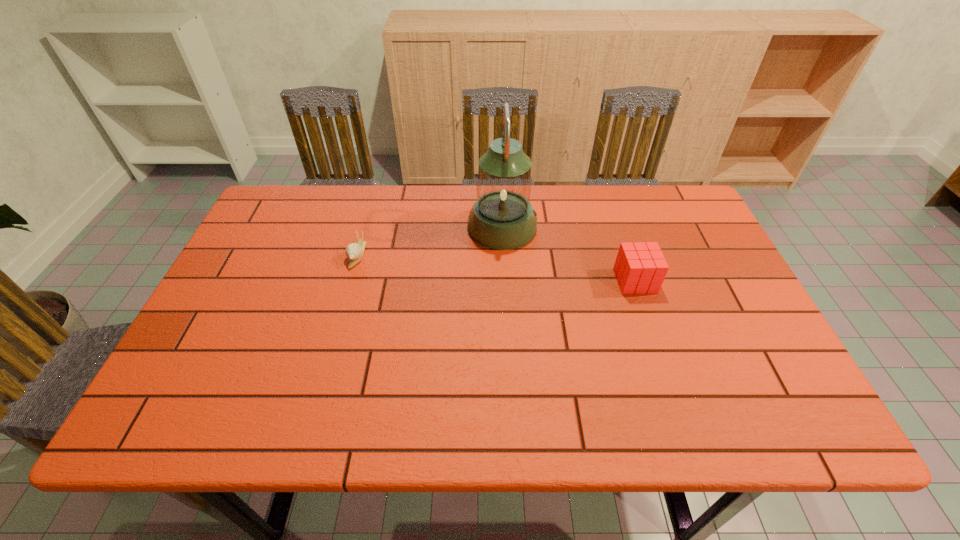
At what (x,y) coordinates should I click in order to perform the action: click on free space that satisfies the following two spatial constraints: 1. on the front side of the lantern; 2. on the left side of the second shortest object. Please return your answer as a coordinate pair (x, y). Looking at the image, I should click on (505, 281).